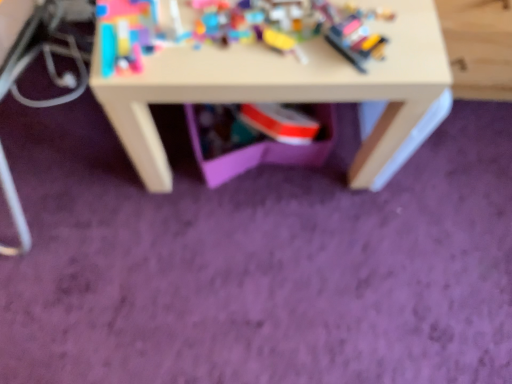
Question: From a real-world perspective, does plastic building blocks at upper center stand above matte white table at center?

Choices:
 (A) yes
 (B) no

Answer: (A)

Question: From a real-world perspective, is plastic building blocks at upper center positioned under matte white table at center based on gravity?

Choices:
 (A) yes
 (B) no

Answer: (B)

Question: From the image's perspective, is plastic building blocks at upper center on matte white table at center?

Choices:
 (A) yes
 (B) no

Answer: (B)

Question: Considering the relative sizes of plastic building blocks at upper center and matte white table at center in the image provided, is plastic building blocks at upper center thinner than matte white table at center?

Choices:
 (A) yes
 (B) no

Answer: (A)

Question: Does plastic building blocks at upper center have a greater height compared to matte white table at center?

Choices:
 (A) yes
 (B) no

Answer: (B)

Question: Is the surface of plastic building blocks at upper center in direct contact with matte white table at center?

Choices:
 (A) yes
 (B) no

Answer: (A)

Question: From a real-world perspective, is matte white table at center on plastic building blocks at upper center?

Choices:
 (A) yes
 (B) no

Answer: (B)

Question: Considering the relative sizes of matte white table at center and plastic building blocks at upper center in the image provided, is matte white table at center wider than plastic building blocks at upper center?

Choices:
 (A) no
 (B) yes

Answer: (B)

Question: Is matte white table at center bigger than plastic building blocks at upper center?

Choices:
 (A) yes
 (B) no

Answer: (A)

Question: Is matte white table at center next to plastic building blocks at upper center and touching it?

Choices:
 (A) yes
 (B) no

Answer: (A)

Question: From a real-world perspective, is matte white table at center under plastic building blocks at upper center?

Choices:
 (A) yes
 (B) no

Answer: (A)

Question: Considering the relative sizes of matte white table at center and plastic building blocks at upper center in the image provided, is matte white table at center smaller than plastic building blocks at upper center?

Choices:
 (A) no
 (B) yes

Answer: (A)

Question: Considering the relative positions of plastic building blocks at upper center and matte white table at center in the image provided, is plastic building blocks at upper center to the left or to the right of matte white table at center?

Choices:
 (A) left
 (B) right

Answer: (A)